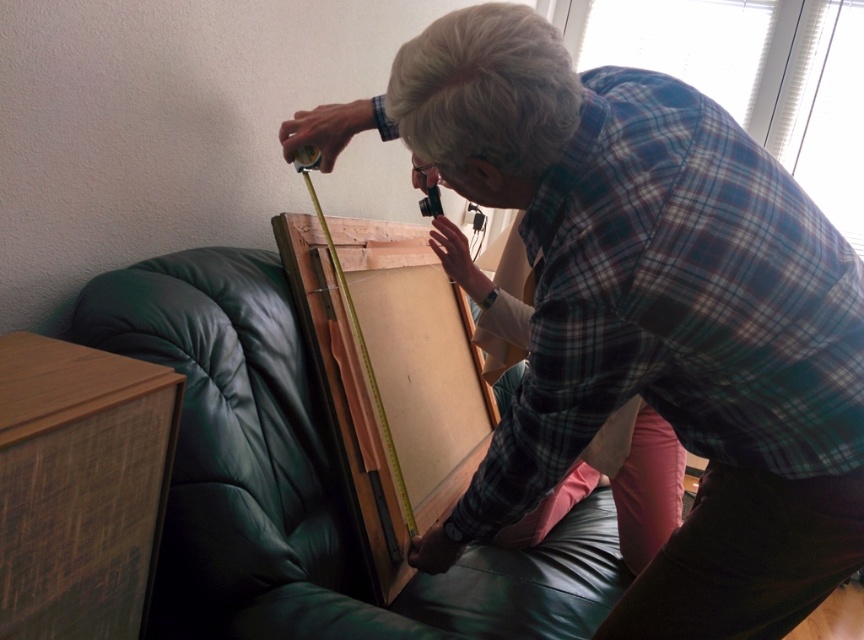
You are helping someone arrange furniture in a living room. They want to place the green leather couch at center and the wooden at left in a way that follows the current layout. Which object should be placed first to maintain the correct spatial relationship?

The wooden at left should be placed first because the green leather couch at center is positioned on the right side of the wooden at left, so placing the wooden at left first ensures the couch can be correctly placed to its right.

You are helping someone decide if a new plant stand that is 2 feet tall will fit in their living room. They want to place it between the green leather couch at center and the wooden at left. Based on the image, will the plant stand be taller than either of these objects?

The green leather couch at center is shorter than wooden at left. Since the plant stand is 2 feet tall, it could potentially be taller than the green leather couch at center if the couch is shorter than 2 feet. However, without knowing the exact height of the wooden at left, we cannot confirm if it will be taller than both. The answer requires more information about their heights.

What are the coordinates of the matte plaid shirt at center?

The coordinates of the matte plaid shirt at center are at point (646, 312).